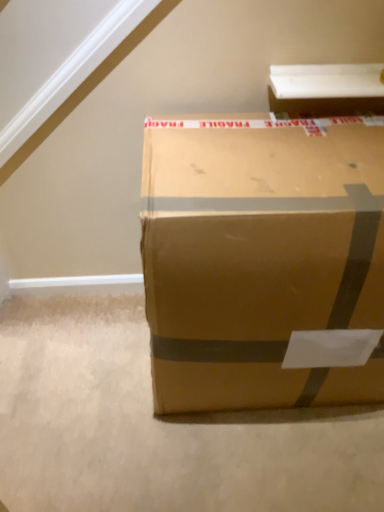
Where is `blank area to the left of brown cardboard box at center`? The width and height of the screenshot is (384, 512). blank area to the left of brown cardboard box at center is located at coordinates (83, 380).